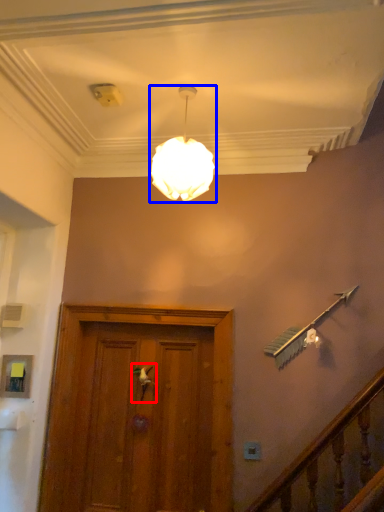
Question: Among these objects, which one is nearest to the camera, door handle (highlighted by a red box) or lamp (highlighted by a blue box)?

Choices:
 (A) door handle
 (B) lamp

Answer: (B)